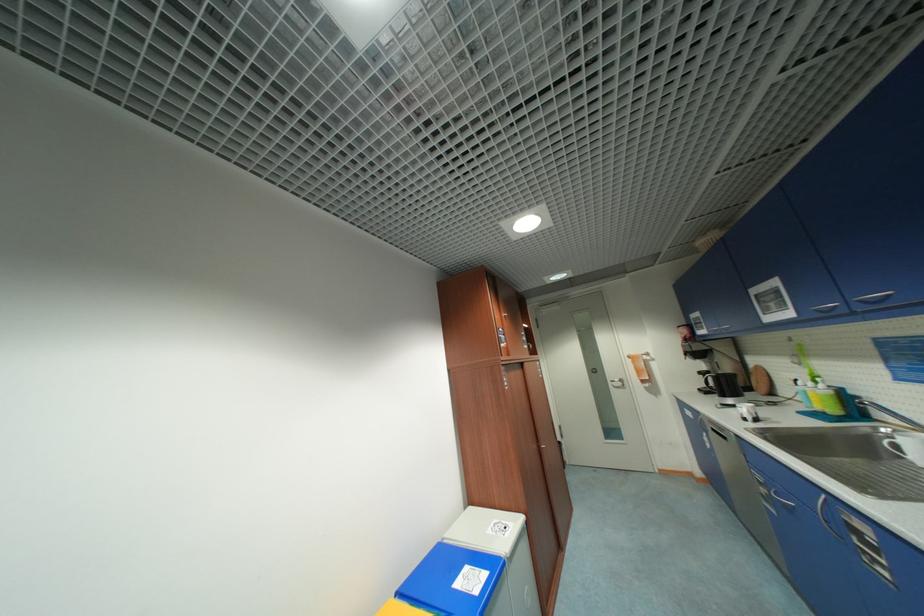
Locate an element on the screen. white coffee carafe handle is located at coordinates (892, 447).